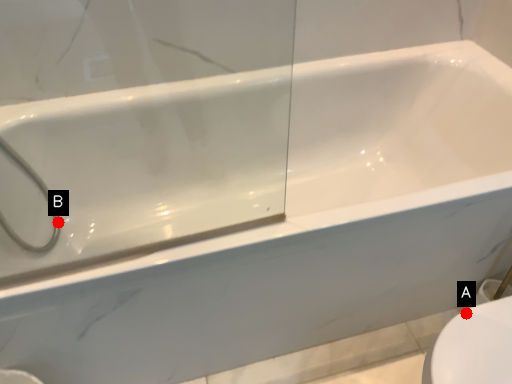
Question: Two points are circled on the image, labeled by A and B beside each circle. Among these points, which one is farthest from the camera?

Choices:
 (A) A is further
 (B) B is further

Answer: (B)